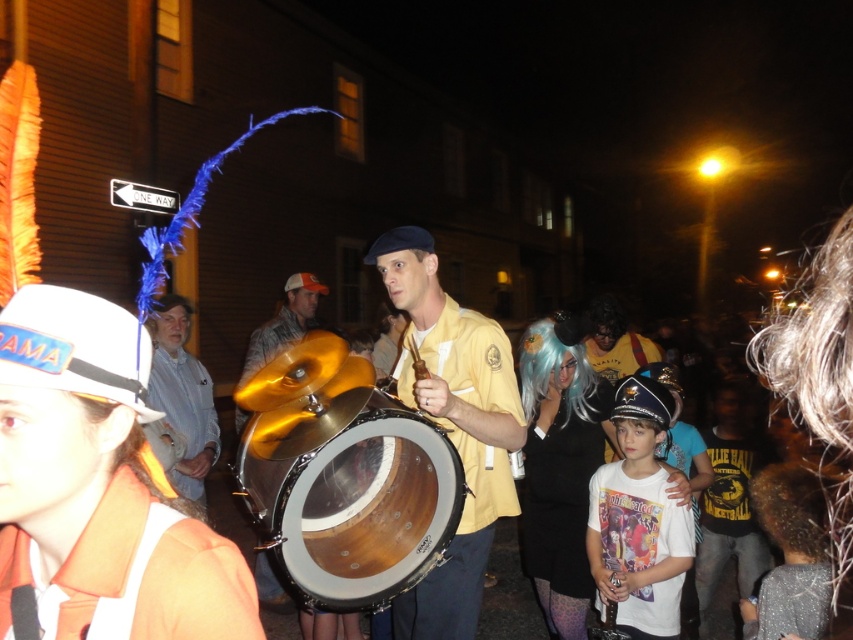
The height and width of the screenshot is (640, 853). What do you see at coordinates (639, 518) in the screenshot?
I see `white matte shirt at center` at bounding box center [639, 518].

Between point (653, 490) and point (788, 557), which one is positioned behind?

Positioned behind is point (653, 490).

Between point (682, 522) and point (801, 532), which one is positioned behind?

The point (682, 522) is behind.

At what (x,y) coordinates should I click in order to perform the action: click on white matte shirt at center. Please return your answer as a coordinate pair (x, y). Looking at the image, I should click on (639, 518).

Does white shirt at center appear under gold metallic drum at center?

Yes, white shirt at center is below gold metallic drum at center.

Is white shirt at center to the right of gold metallic drum at center from the viewer's perspective?

In fact, white shirt at center is to the left of gold metallic drum at center.

Does point (157, 404) lie in front of point (241, 408)?

Yes.

Where is `white shirt at center`? This screenshot has width=853, height=640. white shirt at center is located at coordinates (183, 396).

Can you confirm if sparkly gray dress at lower right is taller than gold metallic drum at center?

In fact, sparkly gray dress at lower right may be shorter than gold metallic drum at center.

Is sparkly gray dress at lower right in front of gold metallic drum at center?

Yes, it is.

The image size is (853, 640). What do you see at coordinates (790, 556) in the screenshot?
I see `sparkly gray dress at lower right` at bounding box center [790, 556].

I want to click on sparkly gray dress at lower right, so click(790, 556).